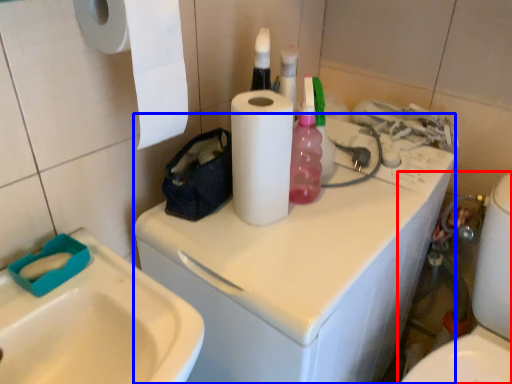
Question: Which object appears closest to the camera in this image, toilet (highlighted by a red box) or washing machine (highlighted by a blue box)?

Choices:
 (A) toilet
 (B) washing machine

Answer: (B)